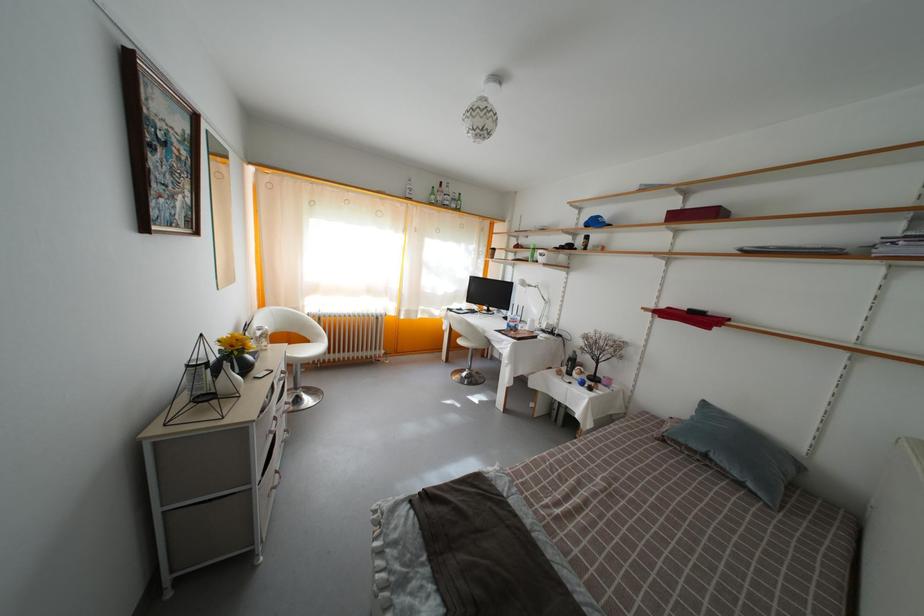
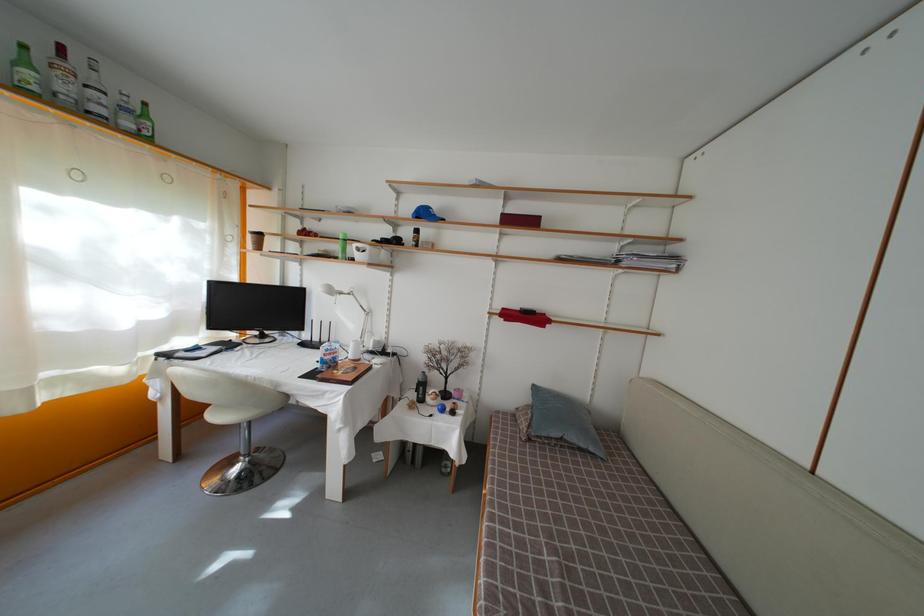
Find the pixel in the second image that matches (439,200) in the first image.

(31, 69)